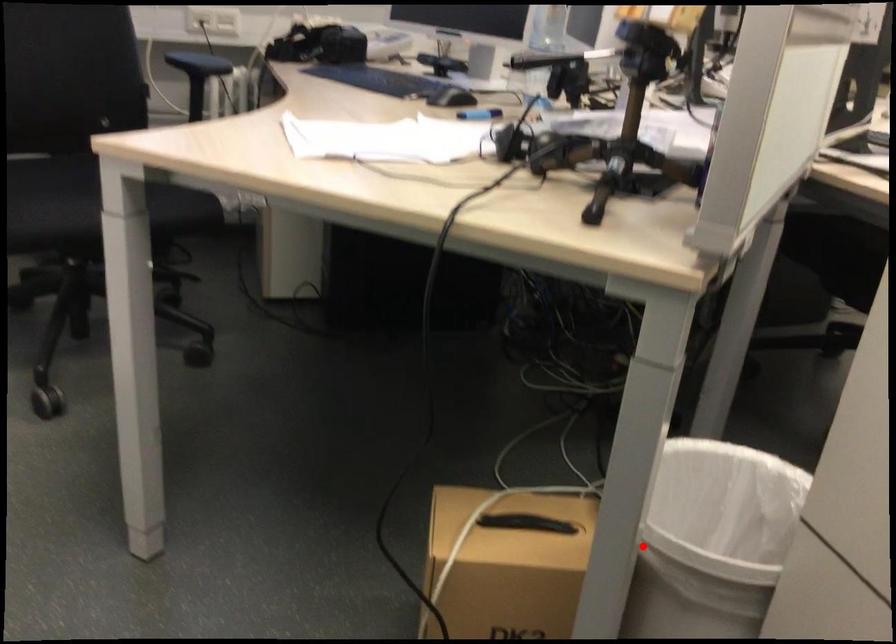
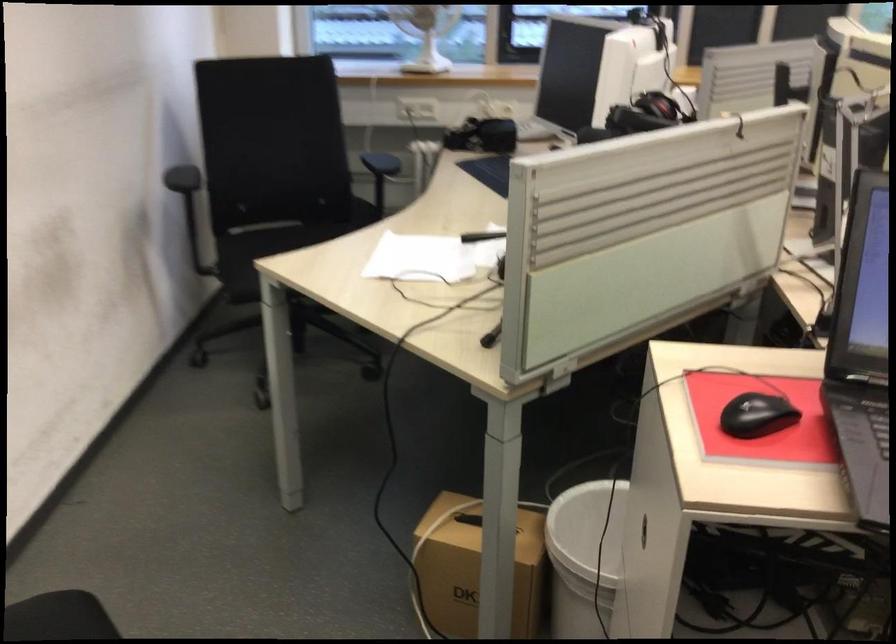
Question: I am providing you with two images of the same scene from different viewpoints. Image1 has a red point marked. In image2, the corresponding 3D location appears at what relative position? Reply with the corresponding letter.

Choices:
 (A) Closer
 (B) Farther

Answer: (B)